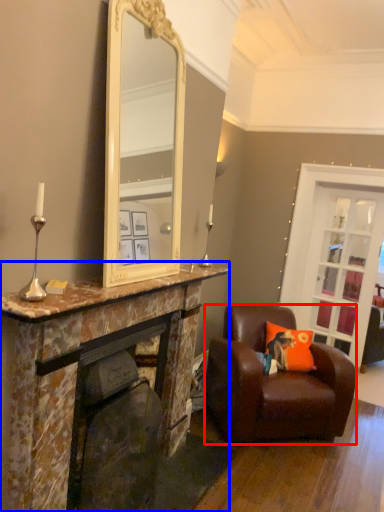
Question: Which object appears farthest to the camera in this image, chair (highlighted by a red box) or cabinetry (highlighted by a blue box)?

Choices:
 (A) chair
 (B) cabinetry

Answer: (A)